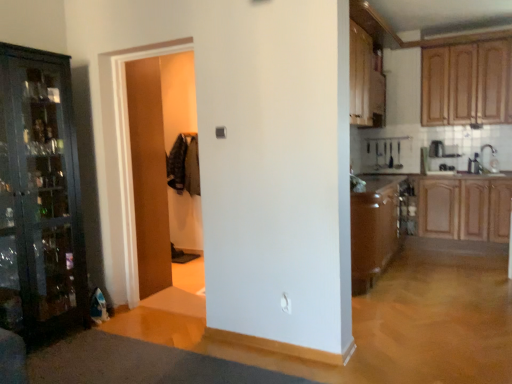
Question: Is wooden cabinets at upper right, the third cabinetry ordered from the bottom, taller or shorter than wooden cabinet at right, marked as the first cabinetry in a bottom-to-top arrangement?

Choices:
 (A) short
 (B) tall

Answer: (B)

Question: From the image's perspective, is wooden cabinets at upper right, marked as the 1th cabinetry in a top-to-bottom arrangement, positioned above or below wooden cabinet at right, which is counted as the 3th cabinetry, starting from the top?

Choices:
 (A) below
 (B) above

Answer: (B)

Question: Considering the real-world distances, which object is farthest from the wooden cabinet at upper right, marked as the second cabinetry in a bottom-to-top arrangement?

Choices:
 (A) wooden cabinets at upper right, the third cabinetry ordered from the bottom
 (B) brown laminate counter top at center
 (C) wooden door at center
 (D) wooden cabinet at right, marked as the first cabinetry in a bottom-to-top arrangement
 (E) white glossy sink at right

Answer: (C)

Question: Which of these objects is positioned farthest from the white glossy sink at right?

Choices:
 (A) wooden door at center
 (B) wooden cabinets at upper right, marked as the 1th cabinetry in a top-to-bottom arrangement
 (C) wooden cabinet at right, marked as the first cabinetry in a bottom-to-top arrangement
 (D) wooden cabinet at upper right, which is the second cabinetry in top-to-bottom order
 (E) brown laminate counter top at center

Answer: (A)